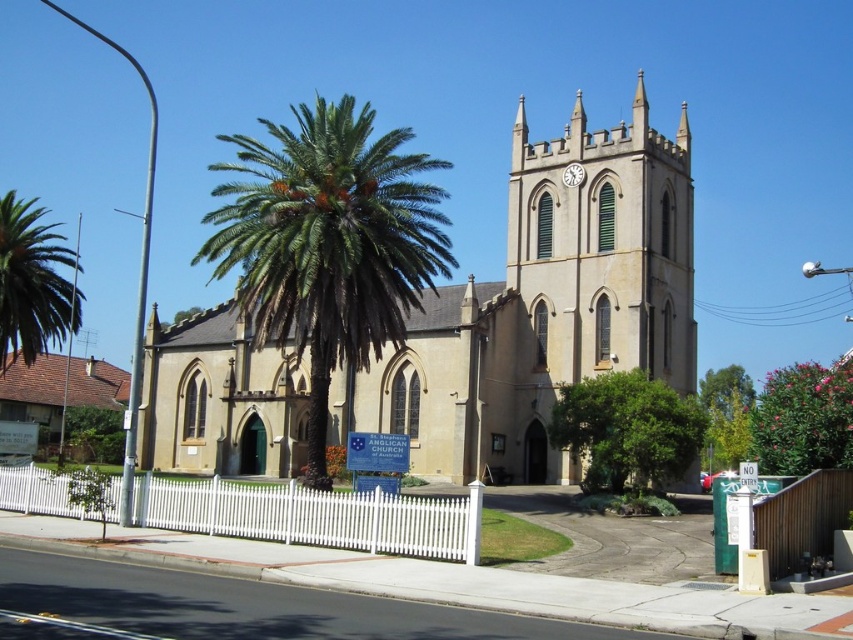
Does green leafy palm tree at left have a larger size compared to pink glossy tree at right?

Yes, green leafy palm tree at left is bigger than pink glossy tree at right.

From the picture: Between green leafy palm tree at left and pink glossy tree at right, which one appears on the left side from the viewer's perspective?

From the viewer's perspective, green leafy palm tree at left appears more on the left side.

This screenshot has height=640, width=853. What do you see at coordinates (33, 282) in the screenshot?
I see `green leafy palm tree at left` at bounding box center [33, 282].

Where is `green leafy palm tree at left`? The image size is (853, 640). green leafy palm tree at left is located at coordinates (33, 282).

Measure the distance between green leafy palm tree at center and pink glossy tree at right.

green leafy palm tree at center is 127.75 feet from pink glossy tree at right.

Does green leafy palm tree at center have a smaller size compared to pink glossy tree at right?

Incorrect, green leafy palm tree at center is not smaller in size than pink glossy tree at right.

Measure the distance between green leafy palm tree at center and camera.

green leafy palm tree at center and camera are 174.25 feet apart.

Identify the location of green leafy palm tree at center. The width and height of the screenshot is (853, 640). (328, 243).

You are a GUI agent. You are given a task and a screenshot of the screen. Output one action in this format:
    pyautogui.click(x=<x>, y=<y>)
    Task: Click on the beige stone church at center
    This screenshot has width=853, height=640.
    Given the screenshot: What is the action you would take?
    pyautogui.click(x=544, y=307)

Who is more forward, (647,192) or (74,456)?

Point (647,192) is more forward.

Measure the distance between point (453,369) and camera.

A distance of 68.86 meters exists between point (453,369) and camera.

The image size is (853, 640). I want to click on beige stone church at center, so tap(544, 307).